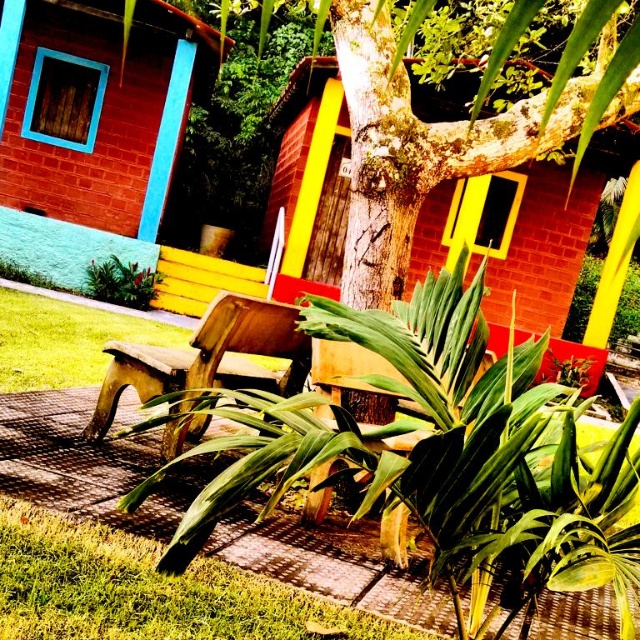
Which is above, brick wall at upper left or wooden bench at center?

brick wall at upper left is higher up.

Does brick wall at upper left have a smaller size compared to wooden bench at center?

Actually, brick wall at upper left might be larger than wooden bench at center.

Consider the image. Who is more forward, (141, 58) or (196, 333)?

Point (196, 333) is in front.

Find the location of a particular element. Image resolution: width=640 pixels, height=640 pixels. brick wall at upper left is located at coordinates (92, 125).

Which is more to the left, wooden bench at center or green leafy plant at lower left?

green leafy plant at lower left is more to the left.

Between wooden bench at center and green leafy plant at lower left, which one is positioned lower?

wooden bench at center is below.

Is point (230, 346) in front of point (147, 282)?

Yes, it is in front of point (147, 282).

The width and height of the screenshot is (640, 640). Find the location of `wooden bench at center`. wooden bench at center is located at coordinates (209, 356).

Who is more distant from viewer, (451, 216) or (237, 326)?

The point (451, 216) is behind.

Locate an element on the screen. Image resolution: width=640 pixels, height=640 pixels. brick textured hut at center is located at coordinates (308, 180).

Is point (301, 282) positioned behind point (195, 344)?

Yes, point (301, 282) is farther from viewer.

At what (x,y) coordinates should I click in order to perform the action: click on brick textured hut at center. Please return your answer as a coordinate pair (x, y). The height and width of the screenshot is (640, 640). Looking at the image, I should click on (308, 180).